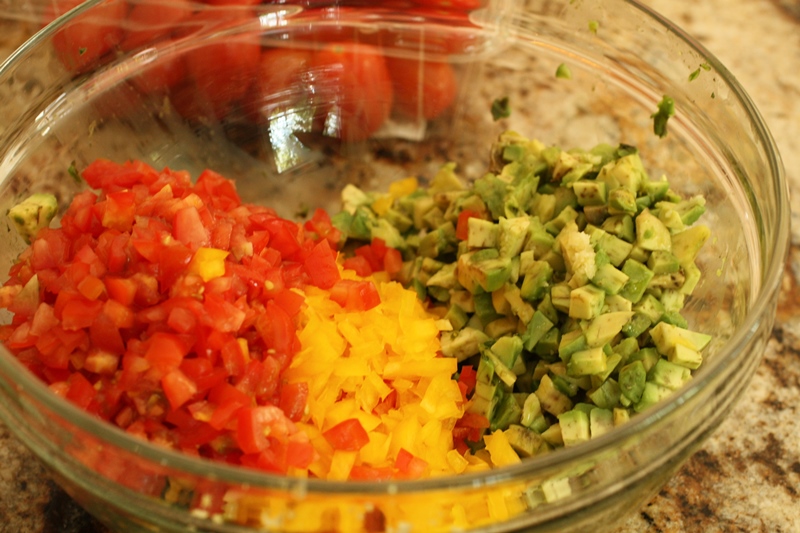
Locate an element on the screen. countertop is located at coordinates (758, 484).